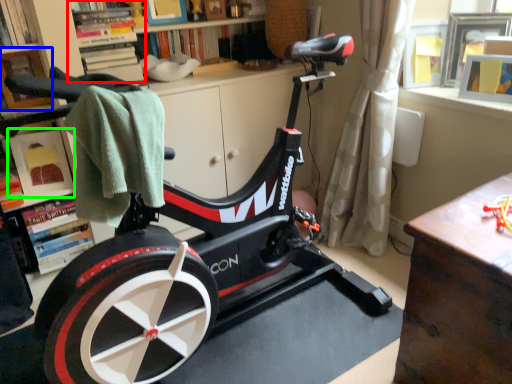
Question: Which object is positioned farthest from shelf (highlighted by a red box)? Select from shelf (highlighted by a blue box) and shelf (highlighted by a green box).

Choices:
 (A) shelf
 (B) shelf

Answer: (B)